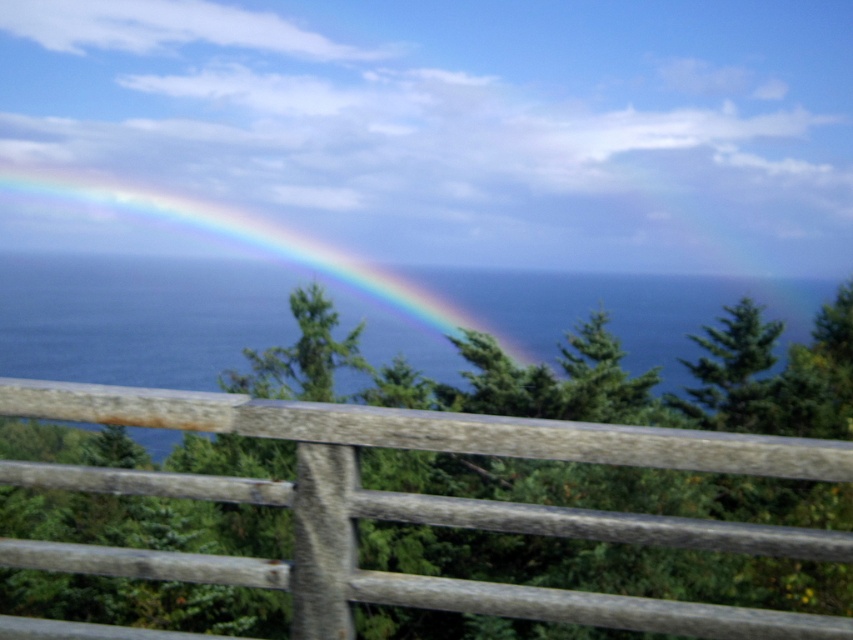
Question: Considering the relative positions of blue water at center and rainbow translucent at left in the image provided, where is blue water at center located with respect to rainbow translucent at left?

Choices:
 (A) above
 (B) below

Answer: (B)

Question: Which of the following is the closest to the observer?

Choices:
 (A) weathered wood fence at center
 (B) blue water at center

Answer: (A)

Question: Does weathered wood fence at center come behind rainbow translucent at left?

Choices:
 (A) yes
 (B) no

Answer: (B)

Question: Does weathered wood fence at center appear on the right side of blue water at center?

Choices:
 (A) yes
 (B) no

Answer: (B)

Question: Which object appears closest to the camera in this image?

Choices:
 (A) rainbow translucent at left
 (B) weathered wood fence at center
 (C) blue water at center

Answer: (B)

Question: Based on their relative distances, which object is nearer to the blue water at center?

Choices:
 (A) rainbow translucent at left
 (B) weathered wood fence at center

Answer: (A)